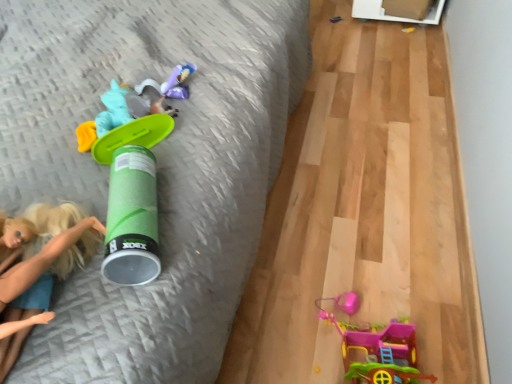
Question: Is metallic silver toy at upper right, which appears as the 5th toy when ordered from the bottom, wider or thinner than matte purple plush at center, the fourth toy positioned from the bottom?

Choices:
 (A) wide
 (B) thin

Answer: (A)

Question: Looking at the image, does metallic silver toy at upper right, the first toy when ordered from right to left, seem bigger or smaller compared to matte purple plush at center, the fourth toy positioned from the bottom?

Choices:
 (A) big
 (B) small

Answer: (B)

Question: Based on their relative distances, which object is nearer to the plastic pink toy house at lower right, which is the fifth toy in top-to-bottom order?

Choices:
 (A) metallic silver toy at upper right, marked as the 1th toy in a back-to-front arrangement
 (B) green plastic bed frame at left
 (C) green matte canister at center, positioned as the fourth toy in top-to-bottom order
 (D) matte purple plush at center, the second toy when ordered from top to bottom
 (E) green plastic toy at upper left, which is the third toy from top to bottom

Answer: (C)

Question: Which of these objects is positioned farthest from the metallic silver toy at upper right, the first toy when ordered from right to left?

Choices:
 (A) green plastic toy at upper left, which is counted as the 1th toy, starting from the left
 (B) plastic pink toy house at lower right, which ranks as the first toy in bottom-to-top order
 (C) matte purple plush at center, the second toy when ordered from top to bottom
 (D) blonde hair doll at left
 (E) green matte canister at center, positioned as the fourth toy in top-to-bottom order

Answer: (D)